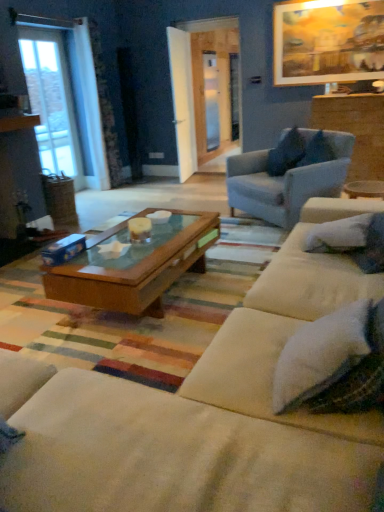
The image size is (384, 512). What do you see at coordinates (51, 100) in the screenshot?
I see `clear glass door at left` at bounding box center [51, 100].

I want to click on white soft pillow at right, the third pillow positioned from the top, so click(339, 234).

What do you see at coordinates (339, 234) in the screenshot? I see `white soft pillow at right, which ranks as the 1th pillow in bottom-to-top order` at bounding box center [339, 234].

Find the location of `blue fabric pillow at upper right, the 1th pillow from the back`. blue fabric pillow at upper right, the 1th pillow from the back is located at coordinates (286, 153).

Image resolution: width=384 pixels, height=512 pixels. Describe the element at coordinates (286, 153) in the screenshot. I see `blue fabric pillow at upper right, which appears as the 1th pillow when viewed from the top` at that location.

The width and height of the screenshot is (384, 512). Find the location of `fluffy white pillow at right, positioned as the 2th pillow in bottom-to-top order`. fluffy white pillow at right, positioned as the 2th pillow in bottom-to-top order is located at coordinates (372, 246).

What is the approximate width of clear glass screen door at center, which is the 1th screen door from back to front?

clear glass screen door at center, which is the 1th screen door from back to front, is 7.66 centimeters wide.

I want to click on light blue fabric armchair at upper right, so click(285, 182).

I want to click on clear glass screen door at center, acting as the 1th screen door starting from the front, so click(x=211, y=100).

Consider the image. Which of these two, blue fabric pillow at upper right, the 3th pillow from the front, or clear glass screen door at center, which is the 1th screen door from back to front, is bigger?

With larger size is blue fabric pillow at upper right, the 3th pillow from the front.

Is the depth of blue fabric pillow at upper right, the 3th pillow from the front, less than that of clear glass screen door at center, which is the 1th screen door from back to front?

Yes, the depth of blue fabric pillow at upper right, the 3th pillow from the front, is less than that of clear glass screen door at center, which is the 1th screen door from back to front.

From a real-world perspective, is blue fabric pillow at upper right, the 3th pillow from the front, on top of clear glass screen door at center, the first screen door positioned from the right?

No, from a real-world perspective, blue fabric pillow at upper right, the 3th pillow from the front, is not over clear glass screen door at center, the first screen door positioned from the right

Does blue fabric pillow at upper right, the 1th pillow from the back, turn towards clear glass screen door at center, marked as the second screen door in a front-to-back arrangement?

No, blue fabric pillow at upper right, the 1th pillow from the back, is not turned towards clear glass screen door at center, marked as the second screen door in a front-to-back arrangement.

Considering the sizes of objects clear glass screen door at center, which ranks as the 2th screen door in back-to-front order, and light blue fabric armchair at upper right in the image provided, who is shorter, clear glass screen door at center, which ranks as the 2th screen door in back-to-front order, or light blue fabric armchair at upper right?

Standing shorter between the two is light blue fabric armchair at upper right.

From a real-world perspective, is clear glass screen door at center, the second screen door from the right, on top of light blue fabric armchair at upper right?

Yes.

Is clear glass screen door at center, which ranks as the 2th screen door in back-to-front order, outside of light blue fabric armchair at upper right?

Indeed, clear glass screen door at center, which ranks as the 2th screen door in back-to-front order, is completely outside light blue fabric armchair at upper right.

Looking at this image, is fluffy white pillow at right, placed as the 1th pillow when sorted from front to back, to the left or to the right of clear glass screen door at center, placed as the second screen door when sorted from left to right, in the image?

fluffy white pillow at right, placed as the 1th pillow when sorted from front to back, is positioned on clear glass screen door at center, placed as the second screen door when sorted from left to right,'s right side.

Is fluffy white pillow at right, arranged as the second pillow when viewed from the top, inside or outside of clear glass screen door at center, placed as the second screen door when sorted from left to right?

fluffy white pillow at right, arranged as the second pillow when viewed from the top, exists outside the volume of clear glass screen door at center, placed as the second screen door when sorted from left to right.

Consider the image. Which of these two, fluffy white pillow at right, arranged as the second pillow when viewed from the top, or clear glass screen door at center, placed as the second screen door when sorted from left to right, is wider?

fluffy white pillow at right, arranged as the second pillow when viewed from the top.

Which is behind, point (58, 121) or point (236, 97)?

Point (236, 97)

How many degrees apart are the facing directions of clear glass door at left and clear glass screen door at center, which is the 1th screen door from back to front?

The angular difference between clear glass door at left and clear glass screen door at center, which is the 1th screen door from back to front, is 2.07 degrees.

Considering the sizes of objects clear glass door at left and clear glass screen door at center, the first screen door positioned from the right, in the image provided, who is wider, clear glass door at left or clear glass screen door at center, the first screen door positioned from the right,?

clear glass door at left.

Consider the image. Visually, is clear glass door at left positioned to the left or to the right of clear glass screen door at center, marked as the second screen door in a front-to-back arrangement?

In the image, clear glass door at left appears on the left side of clear glass screen door at center, marked as the second screen door in a front-to-back arrangement.

From the image's perspective, would you say clear glass door at left is shown under blue fabric pillow at upper right, the 3th pillow from the front?

No.

Is clear glass door at left positioned far away from blue fabric pillow at upper right, which appears as the 1th pillow when viewed from the top?

Yes, clear glass door at left and blue fabric pillow at upper right, which appears as the 1th pillow when viewed from the top, are quite far apart.

Considering the relative sizes of clear glass door at left and blue fabric pillow at upper right, the 3th pillow from the front, in the image provided, is clear glass door at left taller than blue fabric pillow at upper right, the 3th pillow from the front,?

Yes.

Is point (65, 166) positioned in front of point (292, 131)?

No, it is not.

Find the location of a particular element. The height and width of the screenshot is (512, 384). studio couch below the light blue fabric armchair at upper right (from a real-world perspective) is located at coordinates (200, 426).

From a real-world perspective, is light blue fabric armchair at upper right physically located above or below white fabric couch at center?

light blue fabric armchair at upper right is situated higher than white fabric couch at center in the real world.

Choose the correct answer: Is blue fabric pillow at upper right, the 1th pillow from the back, inside white soft pillow at right, which ranks as the 1th pillow in bottom-to-top order, or outside it?

blue fabric pillow at upper right, the 1th pillow from the back, lies outside white soft pillow at right, which ranks as the 1th pillow in bottom-to-top order.

From a real-world perspective, relative to white soft pillow at right, the second pillow viewed from the back, is blue fabric pillow at upper right, the 3th pillow in the bottom-to-top sequence, vertically above or below?

From a real-world perspective, blue fabric pillow at upper right, the 3th pillow in the bottom-to-top sequence, is physically above white soft pillow at right, the second pillow viewed from the back.

This screenshot has height=512, width=384. In order to click on the 2nd pillow positioned above the white soft pillow at right, which ranks as the 1th pillow in bottom-to-top order (from a real-world perspective) in this screenshot , I will do `click(286, 153)`.

How different are the orientations of blue fabric pillow at upper right, which appears as the 1th pillow when viewed from the top, and white soft pillow at right, the second pillow viewed from the back, in degrees?

There is a 54.4-degree angle between the facing directions of blue fabric pillow at upper right, which appears as the 1th pillow when viewed from the top, and white soft pillow at right, the second pillow viewed from the back.

Find the location of a particular element. pillow that is the 1st object located below the clear glass screen door at center, marked as the second screen door in a front-to-back arrangement (from the image's perspective) is located at coordinates (286, 153).

Where is `chair on the right of clear glass screen door at center, the second screen door from the right`? The image size is (384, 512). chair on the right of clear glass screen door at center, the second screen door from the right is located at coordinates (285, 182).

From the image, which object appears to be farther from white soft pillow at right, the third pillow positioned from the top, light blue fabric armchair at upper right or clear glass door at left?

clear glass door at left is positioned further to the anchor white soft pillow at right, the third pillow positioned from the top.

Considering their positions, is clear glass door at left positioned further to fluffy white pillow at right, arranged as the second pillow when viewed from the top, than blue fabric pillow at upper right, which appears as the 1th pillow when viewed from the top?

Based on the image, clear glass door at left appears to be further to fluffy white pillow at right, arranged as the second pillow when viewed from the top.

When comparing their distances from white soft pillow at right, the third pillow positioned from the top, does light blue fabric armchair at upper right or wooden picture frame at upper right seem further?

The object further to white soft pillow at right, the third pillow positioned from the top, is wooden picture frame at upper right.

When comparing their distances from light blue fabric armchair at upper right, does white soft pillow at right, which ranks as the 1th pillow in bottom-to-top order, or blue fabric pillow at upper right, the 3th pillow in the bottom-to-top sequence, seem further?

white soft pillow at right, which ranks as the 1th pillow in bottom-to-top order, is further to light blue fabric armchair at upper right.

Estimate the real-world distances between objects in this image. Which object is closer to white soft pillow at right, the second pillow viewed from the back, blue fabric pillow at upper right, the 3th pillow in the bottom-to-top sequence, or clear glass screen door at center, marked as the second screen door in a front-to-back arrangement?

blue fabric pillow at upper right, the 3th pillow in the bottom-to-top sequence.

From the image, which object appears to be nearer to blue fabric pillow at upper right, the 3th pillow from the front, clear glass screen door at center, placed as the second screen door when sorted from left to right, or clear glass screen door at center, the second screen door from the right?

clear glass screen door at center, placed as the second screen door when sorted from left to right, is positioned closer to the anchor blue fabric pillow at upper right, the 3th pillow from the front.

Which object lies nearer to the anchor point light blue fabric armchair at upper right, white soft pillow at right, the second pillow viewed from the back, or white fabric couch at center?

Based on the image, white soft pillow at right, the second pillow viewed from the back, appears to be nearer to light blue fabric armchair at upper right.

When comparing their distances from clear glass screen door at center, the second screen door from the right, does white soft pillow at right, which ranks as the 2th pillow in front-to-back order, or fluffy white pillow at right, arranged as the second pillow when viewed from the top, seem closer?

Among the two, white soft pillow at right, which ranks as the 2th pillow in front-to-back order, is located nearer to clear glass screen door at center, the second screen door from the right.

At what (x,y) coordinates should I click in order to perform the action: click on picture frame between white fabric couch at center and clear glass door at left along the z-axis. Please return your answer as a coordinate pair (x, y). This screenshot has height=512, width=384. Looking at the image, I should click on (328, 41).

I want to click on pillow located between light blue fabric armchair at upper right and clear glass screen door at center, placed as the second screen door when sorted from left to right, in the depth direction, so [x=286, y=153].

Image resolution: width=384 pixels, height=512 pixels. Find the location of `chair between fluffy white pillow at right, placed as the 1th pillow when sorted from front to back, and wooden picture frame at upper right, along the z-axis`. chair between fluffy white pillow at right, placed as the 1th pillow when sorted from front to back, and wooden picture frame at upper right, along the z-axis is located at coordinates (285, 182).

This screenshot has width=384, height=512. I want to click on picture frame located between fluffy white pillow at right, positioned as the 2th pillow in bottom-to-top order, and clear glass screen door at center, the second screen door from the right, in the depth direction, so click(328, 41).